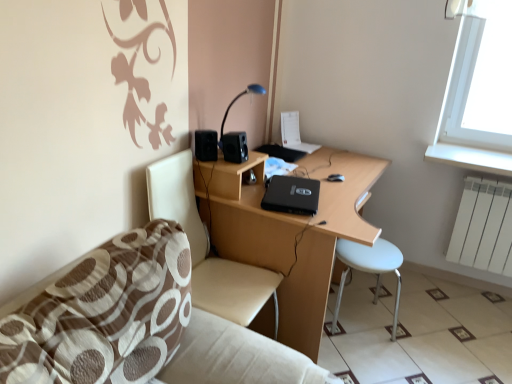
Identify the location of free space to the back side of white plastic stool at lower right. Image resolution: width=512 pixels, height=384 pixels. (372, 289).